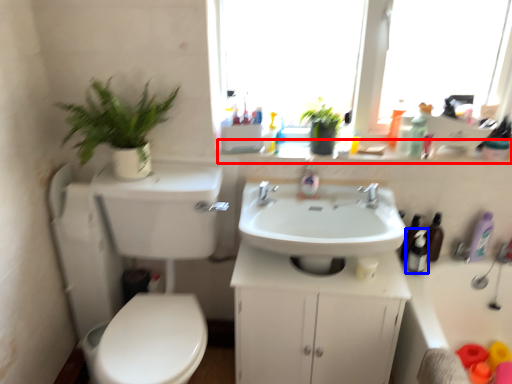
Question: Which point is further to the camera, window sill (highlighted by a red box) or toiletry (highlighted by a blue box)?

Choices:
 (A) window sill
 (B) toiletry

Answer: (A)